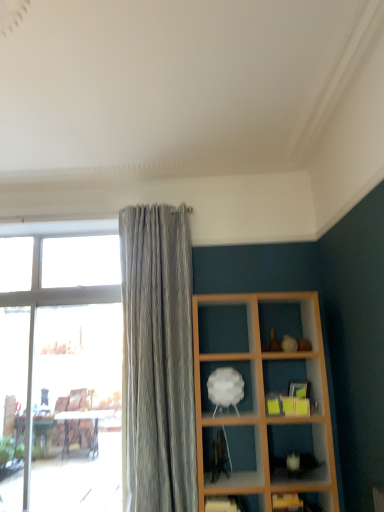
Question: Does white matte cloud at center, which is counted as the 1th shelf, starting from the top, have a lesser height compared to transparent glass window at left?

Choices:
 (A) yes
 (B) no

Answer: (A)

Question: From the image's perspective, is white matte cloud at center, which is counted as the 1th shelf, starting from the top, located beneath transparent glass window at left?

Choices:
 (A) no
 (B) yes

Answer: (A)

Question: From a real-world perspective, is white matte cloud at center, which is counted as the 1th shelf, starting from the top, below transparent glass window at left?

Choices:
 (A) yes
 (B) no

Answer: (B)

Question: Can you confirm if white matte cloud at center, acting as the third shelf starting from the bottom, is positioned to the right of transparent glass window at left?

Choices:
 (A) yes
 (B) no

Answer: (A)

Question: Considering the relative positions of white matte cloud at center, which is counted as the 1th shelf, starting from the top, and transparent glass window at left in the image provided, is white matte cloud at center, which is counted as the 1th shelf, starting from the top, to the left of transparent glass window at left from the viewer's perspective?

Choices:
 (A) yes
 (B) no

Answer: (B)

Question: Do you think white matte cloud at center, acting as the third shelf starting from the bottom, is within wooden shelf at lower right, the first shelf ordered from the bottom, or outside of it?

Choices:
 (A) inside
 (B) outside

Answer: (B)

Question: Considering the relative positions of white matte cloud at center, acting as the third shelf starting from the bottom, and wooden shelf at lower right, the third shelf from the top, in the image provided, is white matte cloud at center, acting as the third shelf starting from the bottom, to the left or to the right of wooden shelf at lower right, the third shelf from the top,?

Choices:
 (A) left
 (B) right

Answer: (A)

Question: Is point (210, 371) positioned closer to the camera than point (284, 503)?

Choices:
 (A) closer
 (B) farther

Answer: (B)

Question: Relative to wooden shelf at lower right, the third shelf from the top, is white matte cloud at center, acting as the third shelf starting from the bottom, in front or behind?

Choices:
 (A) behind
 (B) front

Answer: (A)

Question: Is point (1, 419) closer or farther from the camera than point (226, 499)?

Choices:
 (A) closer
 (B) farther

Answer: (B)

Question: From a real-world perspective, is transparent glass window at left positioned above or below matte white shelf at lower center, which ranks as the 2th shelf in top-to-bottom order?

Choices:
 (A) above
 (B) below

Answer: (A)

Question: From the image's perspective, is transparent glass window at left positioned above or below matte white shelf at lower center, which ranks as the 2th shelf in top-to-bottom order?

Choices:
 (A) below
 (B) above

Answer: (B)

Question: In terms of height, does transparent glass window at left look taller or shorter compared to matte white shelf at lower center, which ranks as the 2th shelf in top-to-bottom order?

Choices:
 (A) tall
 (B) short

Answer: (A)

Question: Is wooden shelf at lower right, the first shelf ordered from the bottom, spatially inside transparent glass window at left, or outside of it?

Choices:
 (A) outside
 (B) inside

Answer: (A)

Question: From their relative heights in the image, would you say wooden shelf at lower right, the third shelf from the top, is taller or shorter than transparent glass window at left?

Choices:
 (A) short
 (B) tall

Answer: (A)